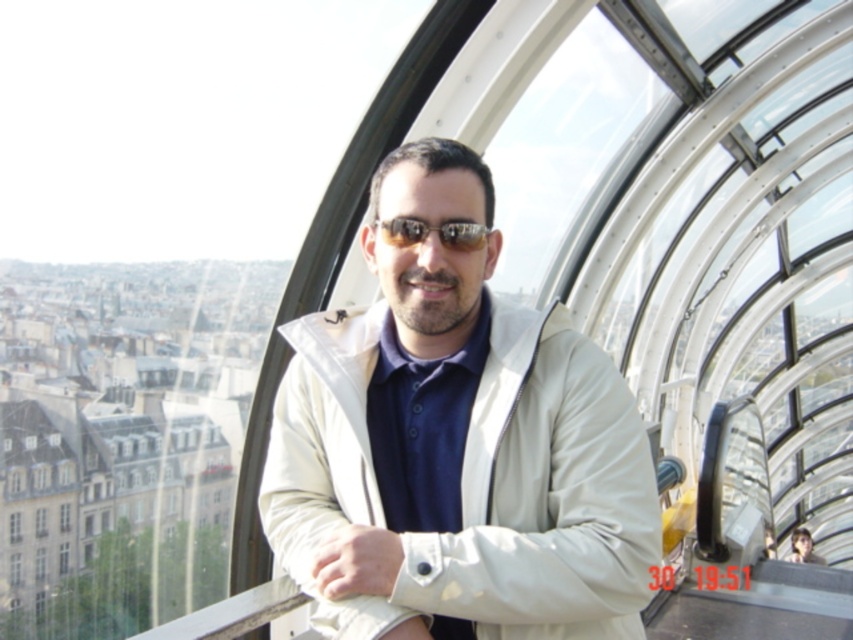
You are standing inside the glass observation pod and want to take a photo of both the point at coordinates point [407,220] and point [809,538] in the scene. Which point should you focus on first to ensure both are in focus?

You should focus on point [407,220] first because it is closer to the camera than point [809,538]. By focusing on the closer point, the farther point will also be within the depth of field, ensuring both are in focus.